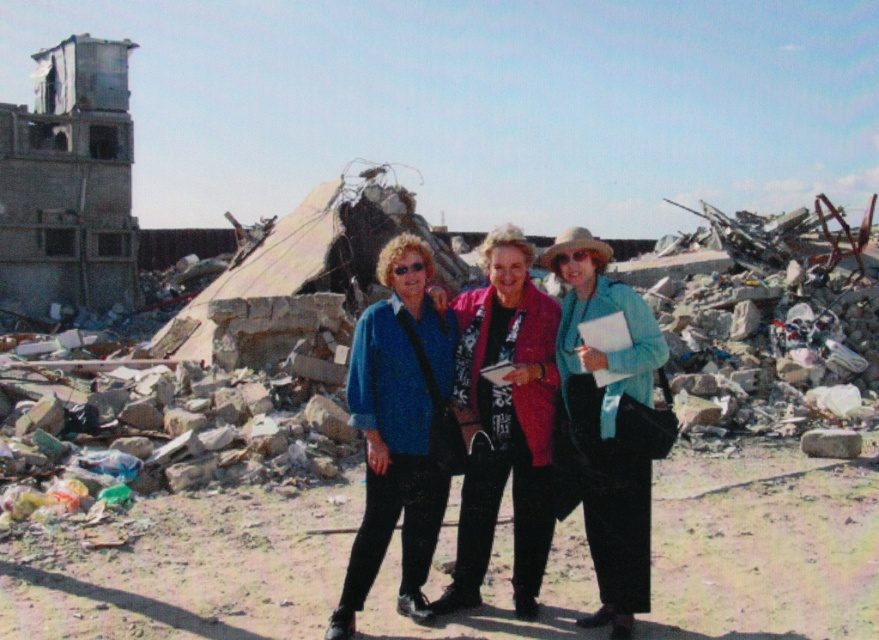
Is blue fabric jacket at center above floral-patterned fabric jacket at center?

Yes.

Between point (513, 410) and point (485, 358), which one is positioned behind?

The point (485, 358) is more distant.

Where is `blue fabric jacket at center`? blue fabric jacket at center is located at coordinates (549, 429).

Which is in front, point (418, 292) or point (522, 301)?

Positioned in front is point (418, 292).

You are a GUI agent. You are given a task and a screenshot of the screen. Output one action in this format:
    pyautogui.click(x=<x>, y=<y>)
    Task: Click on the matte blue sweater at center
    
    Given the screenshot: What is the action you would take?
    pyautogui.click(x=398, y=428)

Measure the distance between matte blue sweater at center and camera.

The distance of matte blue sweater at center from camera is 16.98 feet.

Locate an element on the screen. This screenshot has width=879, height=640. matte blue sweater at center is located at coordinates (398, 428).

Does blue fabric jacket at center appear under matte blue sweater at center?

No.

Is blue fabric jacket at center wider than matte blue sweater at center?

Indeed, blue fabric jacket at center has a greater width compared to matte blue sweater at center.

Who is more distant from viewer, (536, 609) or (332, 634)?

Positioned behind is point (536, 609).

The width and height of the screenshot is (879, 640). I want to click on blue fabric jacket at center, so click(549, 429).